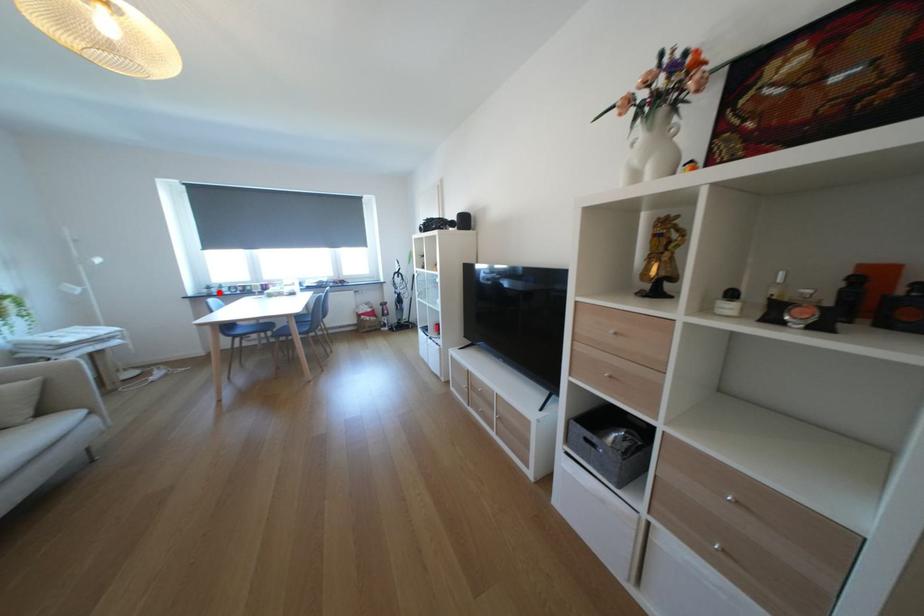
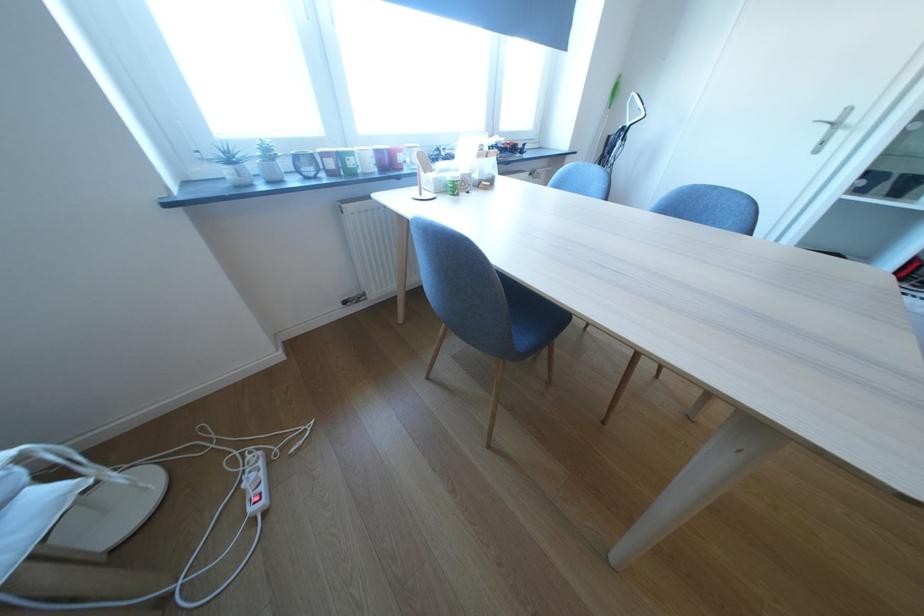
Find the pixel in the second image that matches the highlighted location in the first image.

(249, 175)